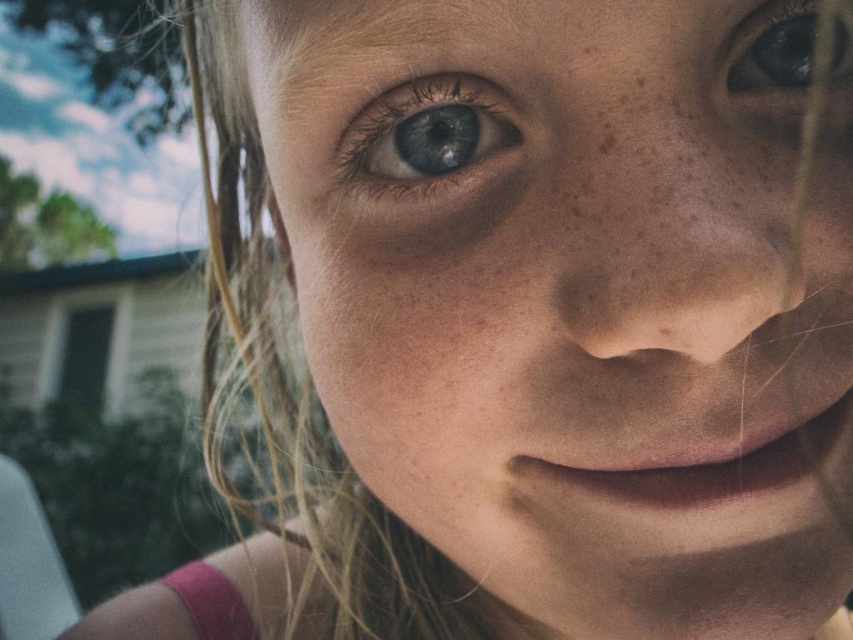
You are holding a small drone that is 2 inches in diameter. You want to fly it to the point marked at coordinates point [450,442]. Can the drone reach that point without getting too close to the person in the image?

The point marked at coordinates point [450,442] is 11.55 inches away from the viewer. Since the drone is 2 inches in diameter, it can safely reach that point without getting too close to the person as there is sufficient distance between them.

You are a photographer adjusting your camera settings. You want to capture a portrait where the subject is in focus while keeping the background blurred. The camera is currently positioned 22.85 centimeters away from the smooth skin face at center. Is this distance sufficient to achieve a shallow depth of field for the desired effect?

The smooth skin face at center and camera are 22.85 centimeters apart from each other. This distance can help achieve a shallow depth of field, making the background blurred while keeping the subject in focus, provided the camera uses a wide aperture setting.

You are a photographer adjusting the focus on a camera. The subject has a smooth skin face at center and a blue glossy eye at upper right. Since the camera can only focus on one object at a time, which object should you focus on to ensure the face is properly captured?

The smooth skin face at center has a greater height compared to the blue glossy eye at upper right, so focusing on the smooth skin face at center will ensure the face is properly captured.